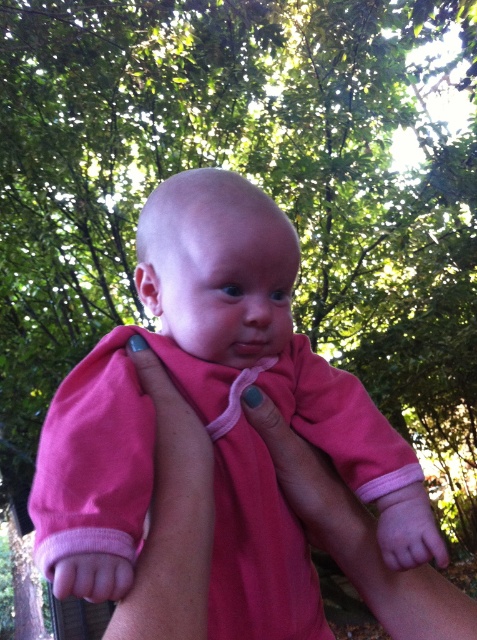
Can you confirm if pink fabric at center is taller than pink soft fabric arm at center?

In fact, pink fabric at center may be shorter than pink soft fabric arm at center.

Identify the location of pink fabric at center. The height and width of the screenshot is (640, 477). (170, 518).

Who is more distant from viewer, (x=208, y=492) or (x=101, y=582)?

The point (x=208, y=492) is behind.

Image resolution: width=477 pixels, height=640 pixels. Identify the location of pink fabric at center. (170, 518).

Can you confirm if pink soft fabric baby at center is bigger than pink fabric at center?

Indeed, pink soft fabric baby at center has a larger size compared to pink fabric at center.

Image resolution: width=477 pixels, height=640 pixels. Identify the location of pink soft fabric baby at center. (211, 410).